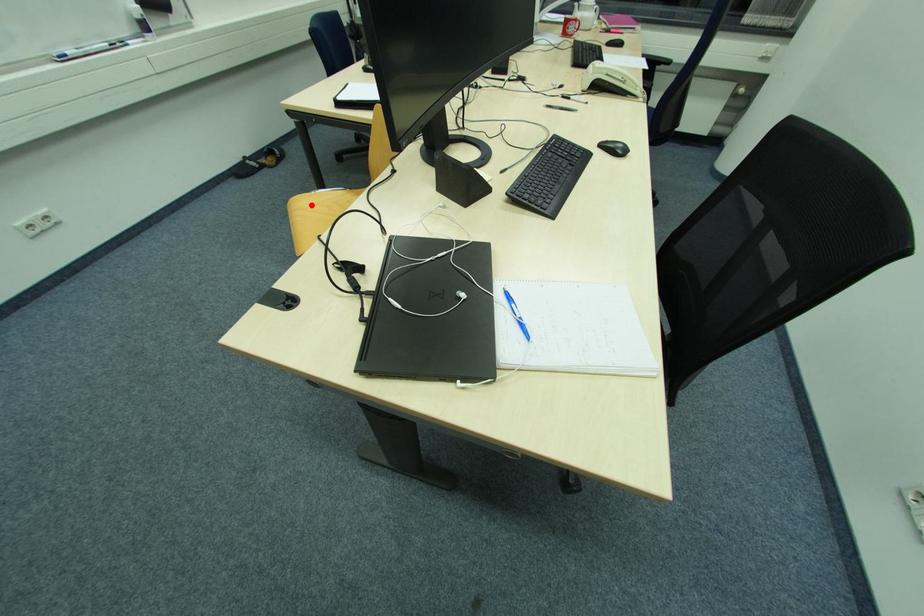
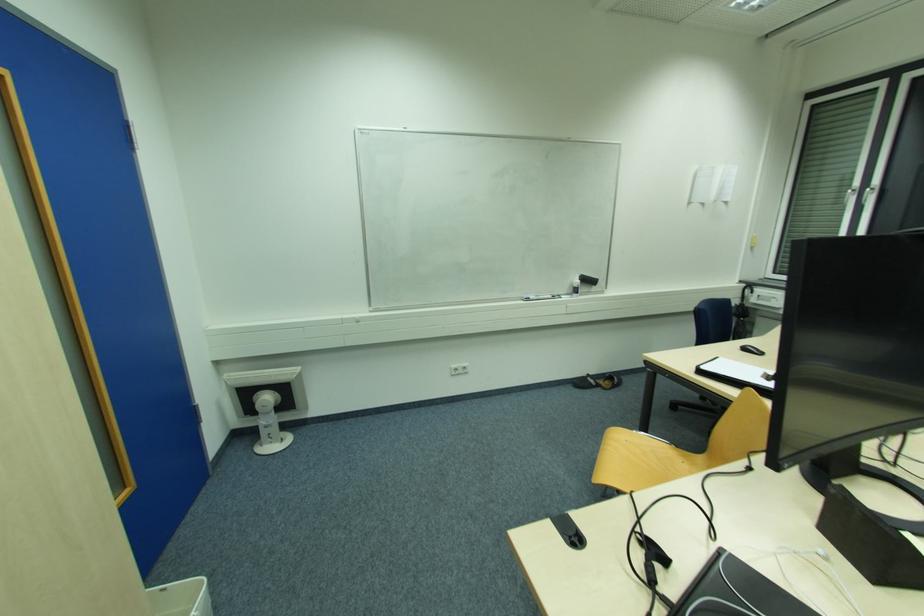
Find the pixel in the second image that matches the highlighted location in the first image.

(628, 442)